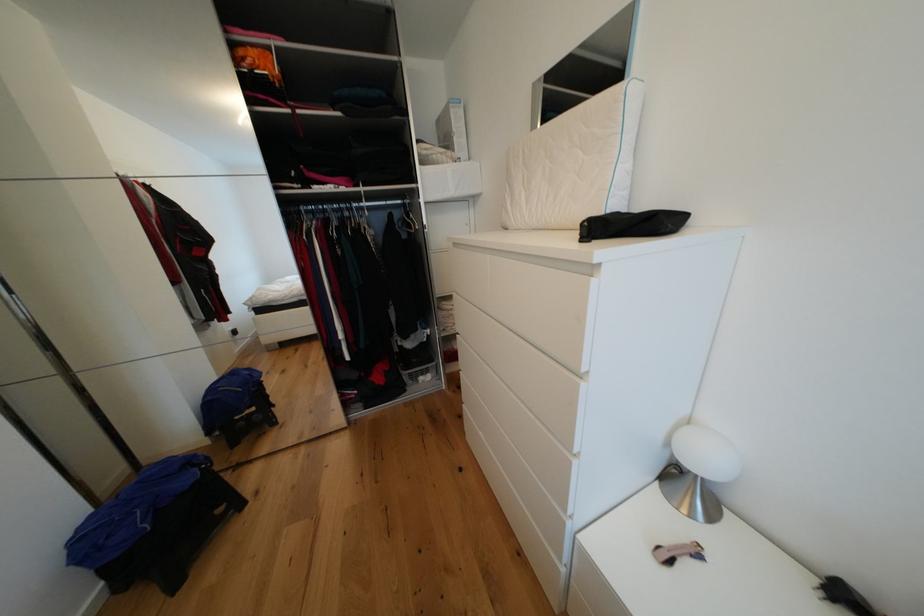
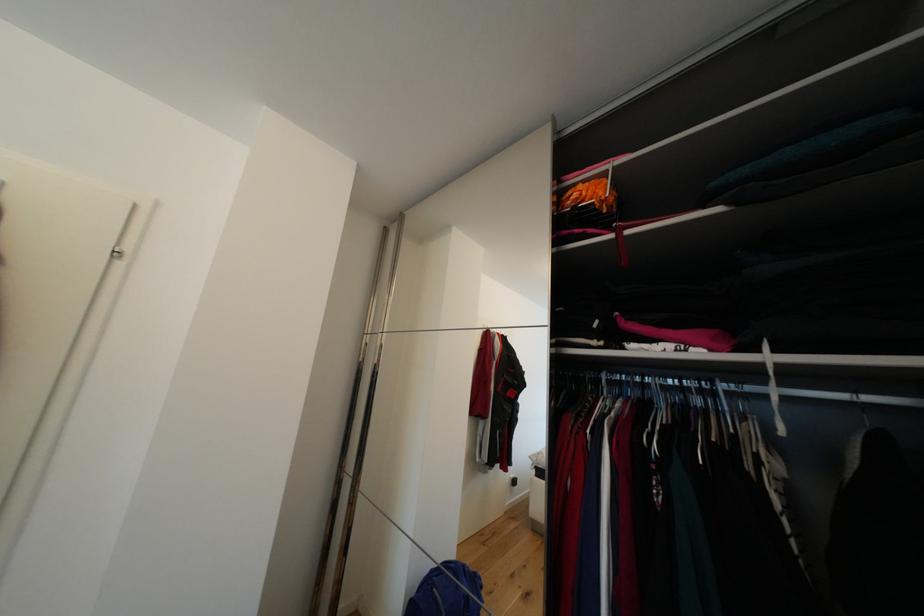
Find the pixel in the second image that matches pixel 259 54 in the first image.

(588, 188)